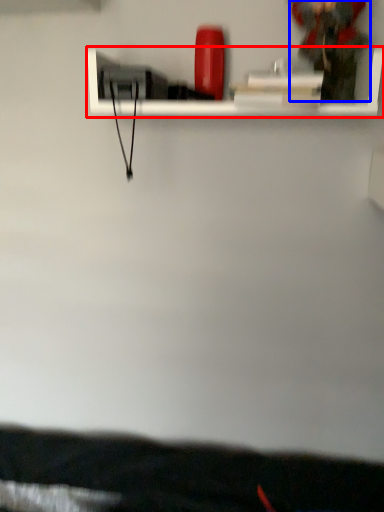
Question: Which of the following is the farthest to the observer, shelf (highlighted by a red box) or person (highlighted by a blue box)?

Choices:
 (A) shelf
 (B) person

Answer: (B)